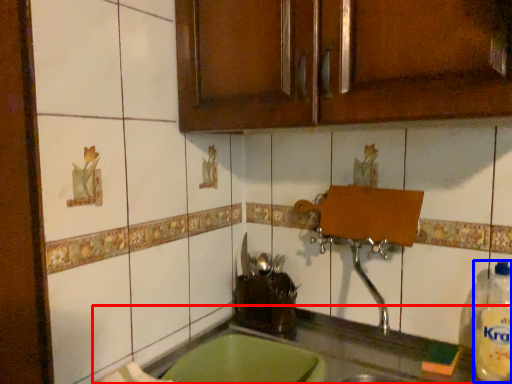
Question: Which of the following is the closest to the observer, countertop (highlighted by a red box) or bottle (highlighted by a blue box)?

Choices:
 (A) countertop
 (B) bottle

Answer: (A)